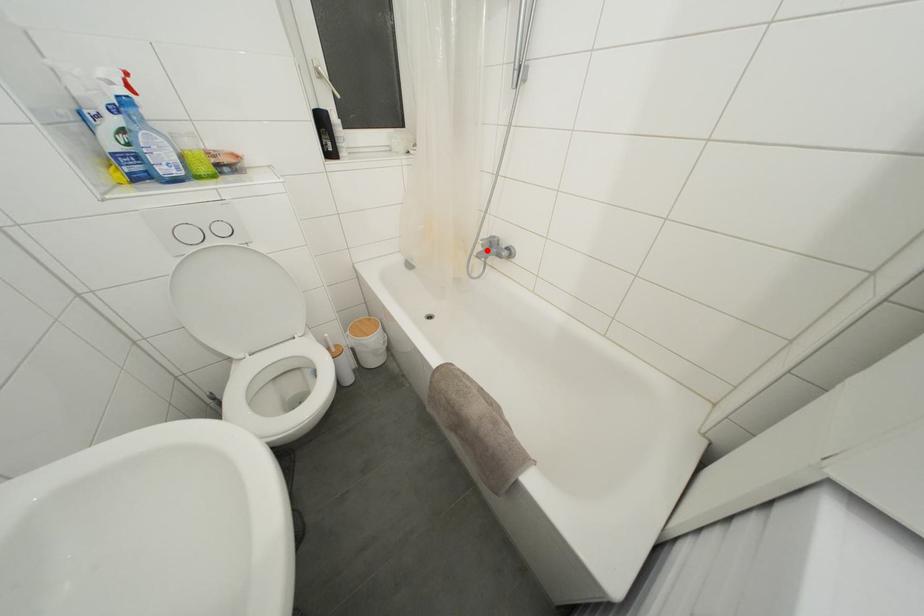
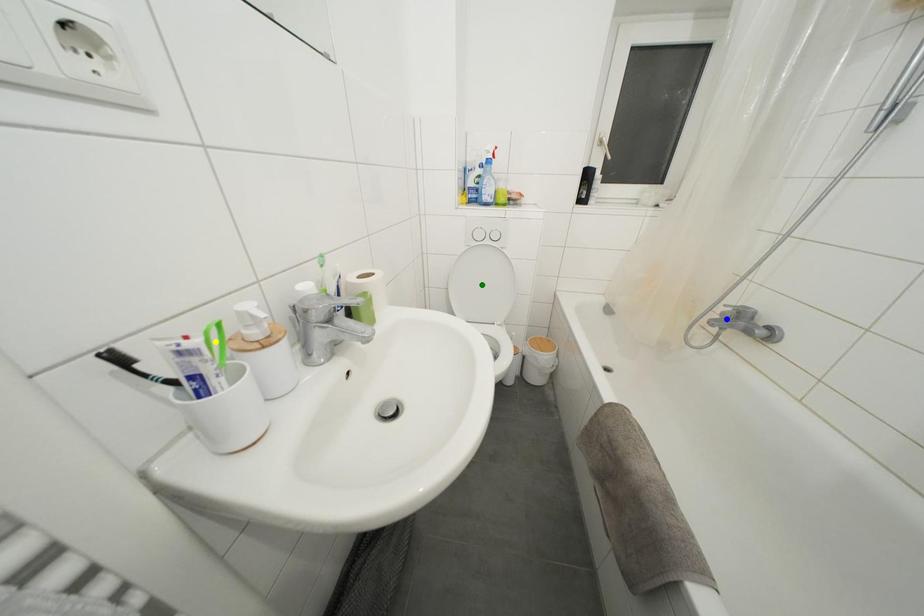
Question: I am providing you with two images of the same scene from different viewpoints. A red point is marked on the first image. You are given multiple points on the second image. Which mark in image 2 goes with the point in image 1?

Choices:
 (A) yellow point
 (B) green point
 (C) blue point

Answer: (C)